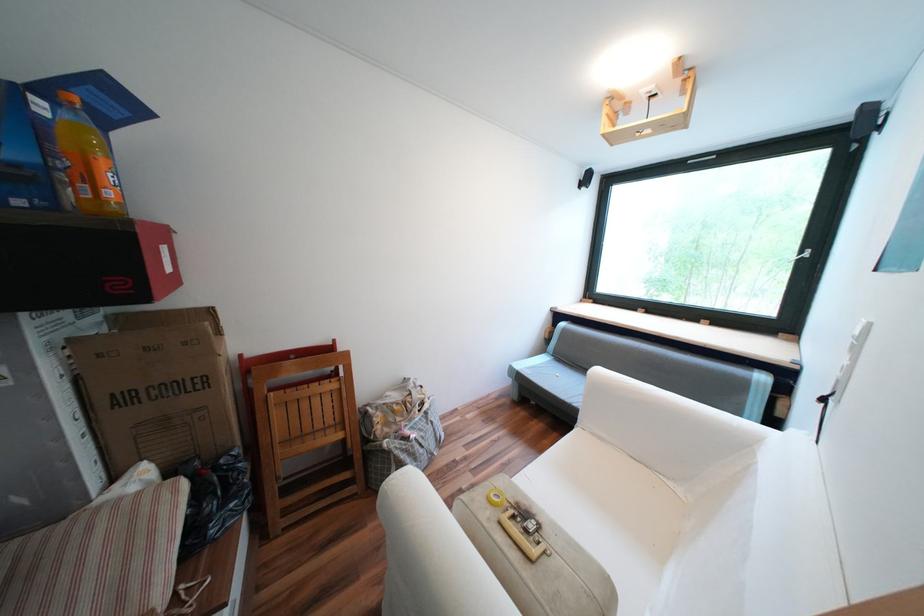
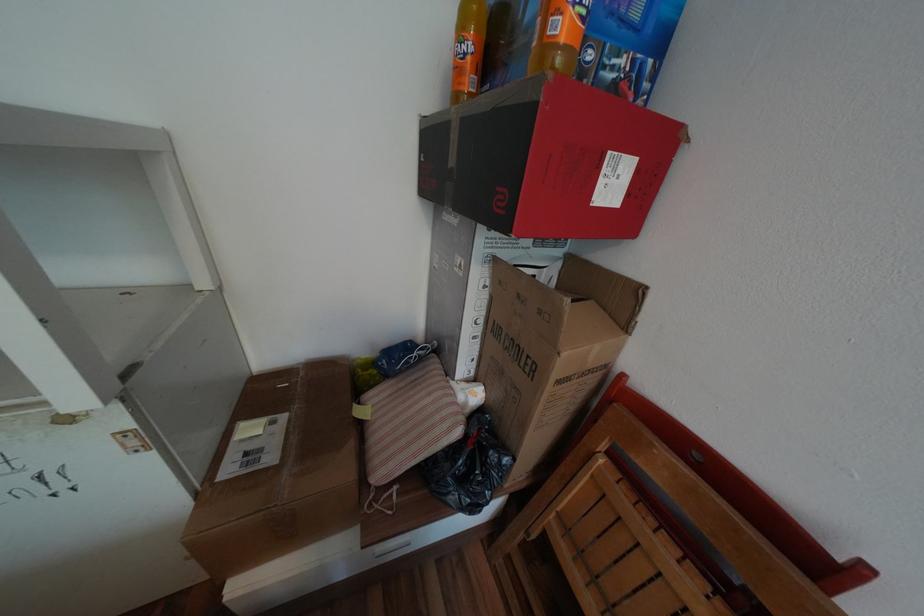
Where in the second image is the point corresponding to point (232, 461) from the first image?

(500, 453)